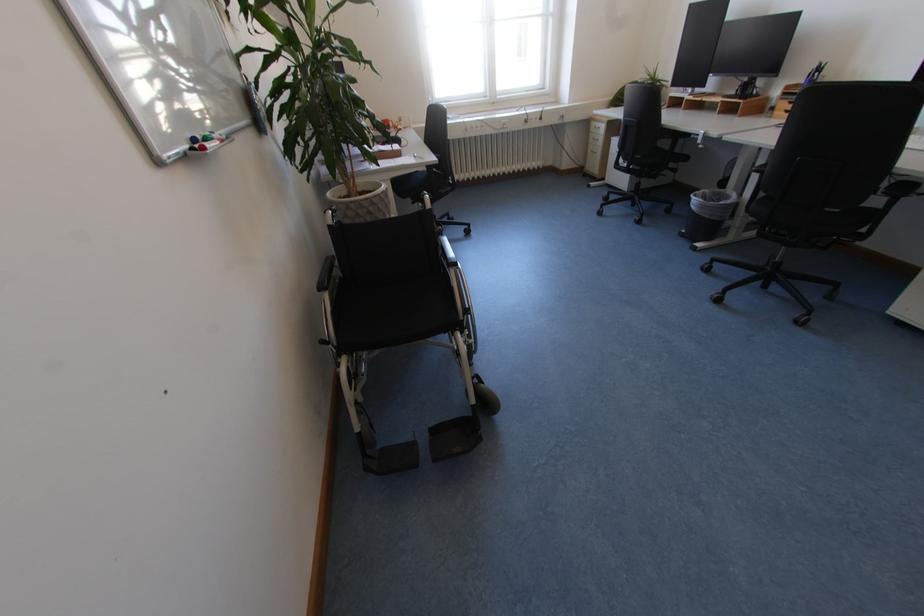
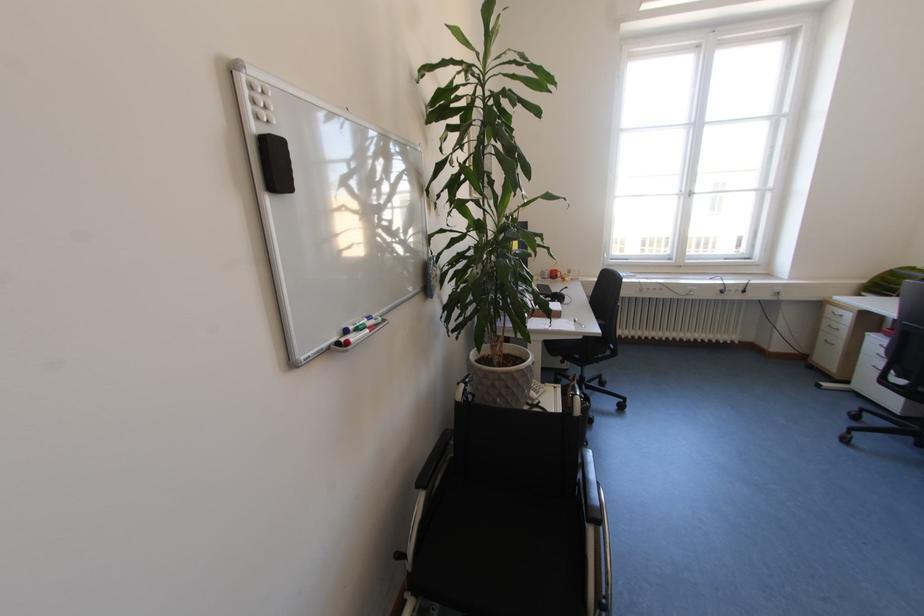
In the second image, find the point that corresponds to [600,152] in the first image.

(833, 342)